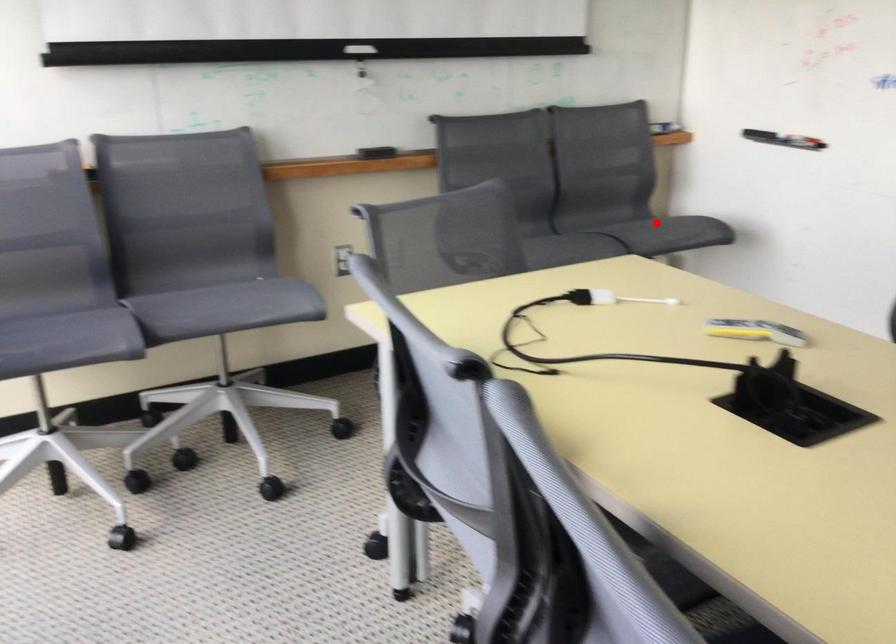
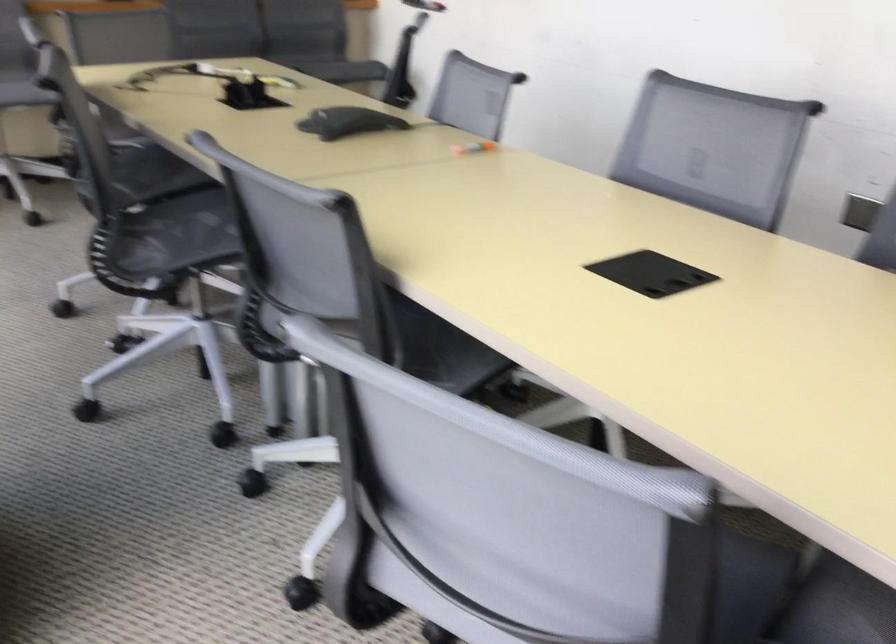
Question: I am providing you with two images of the same scene from different viewpoints. A red point is marked on the first image. Is the red point's position out of view in image 2?

Choices:
 (A) Yes
 (B) No

Answer: (A)